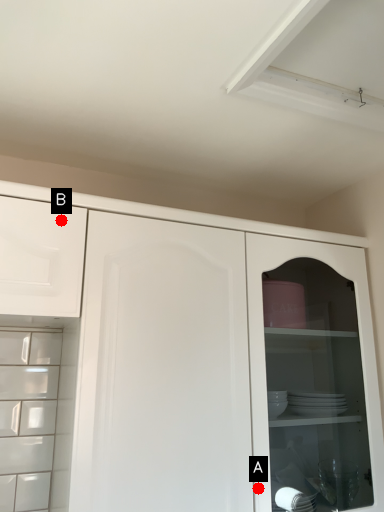
Question: Two points are circled on the image, labeled by A and B beside each circle. Which point appears farthest from the camera in this image?

Choices:
 (A) A is further
 (B) B is further

Answer: (A)